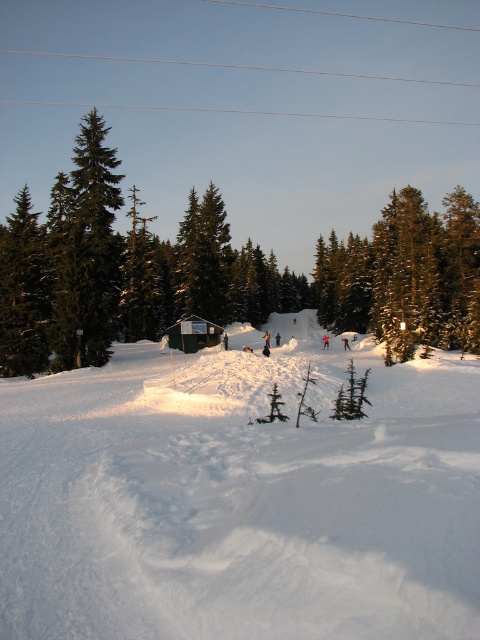
Question: Does green matte tree at center lie behind snow-covered evergreen tree at center?

Choices:
 (A) no
 (B) yes

Answer: (A)

Question: Considering the relative positions of white powdery snow at center and green matte tree at center in the image provided, where is white powdery snow at center located with respect to green matte tree at center?

Choices:
 (A) left
 (B) right

Answer: (A)

Question: Which of the following is the closest to the observer?

Choices:
 (A) (178, 324)
 (B) (74, 420)

Answer: (B)

Question: Which of the following is the closest to the observer?

Choices:
 (A) white powdery snow at center
 (B) green matte tree at center
 (C) white plastic tent at center
 (D) snow-covered evergreen tree at center

Answer: (A)

Question: Does green matte tree at center appear on the left side of snow-covered evergreen tree at center?

Choices:
 (A) no
 (B) yes

Answer: (B)

Question: Which object is farther from the camera taking this photo?

Choices:
 (A) snow-covered evergreen tree at center
 (B) green matte tree at center
 (C) white plastic tent at center
 (D) white powdery snow at center

Answer: (C)